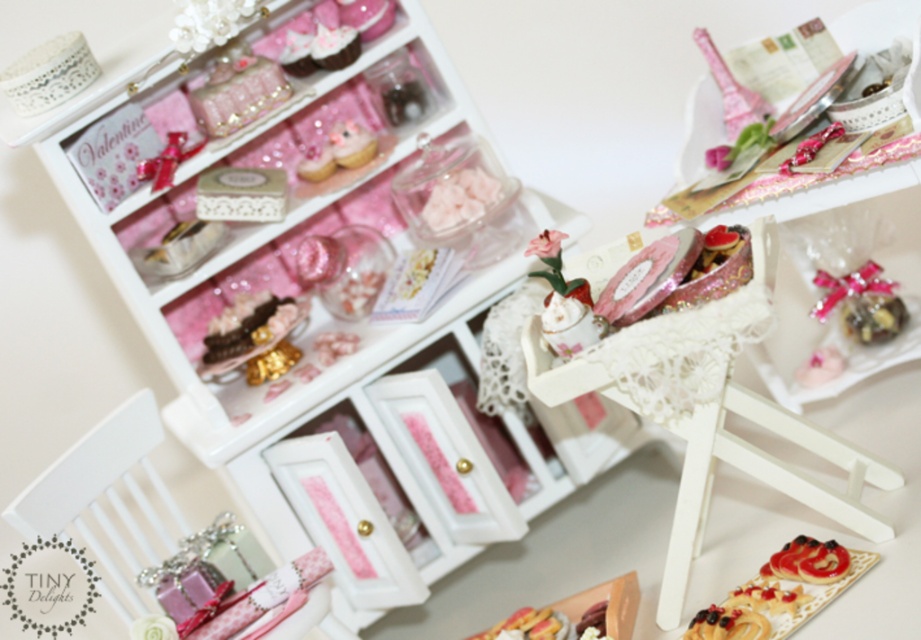
Question: Which of the following is the farthest from the observer?

Choices:
 (A) [x=818, y=556]
 (B) [x=240, y=298]

Answer: (B)

Question: Is the position of shiny gold necklace at upper left less distant than that of chocolate cake at center?

Choices:
 (A) no
 (B) yes

Answer: (B)

Question: Based on their relative distances, which object is farther from the shiny gold necklace at upper left?

Choices:
 (A) glazed pastry at center
 (B) chocolate cake at center

Answer: (A)

Question: Can you confirm if shiny gold necklace at upper left is positioned to the right of chocolate cake at center?

Choices:
 (A) no
 (B) yes

Answer: (B)

Question: Based on their relative distances, which object is farther from the shiny gold necklace at upper left?

Choices:
 (A) glazed pastry at center
 (B) chocolate cake at center

Answer: (A)

Question: Is chocolate cake at center positioned at the back of glazed pastry at center?

Choices:
 (A) no
 (B) yes

Answer: (B)